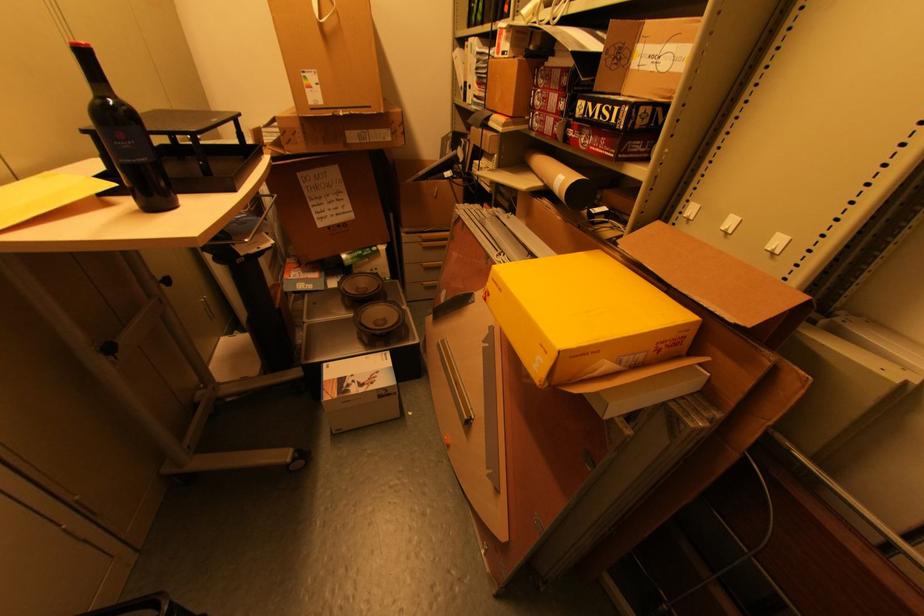
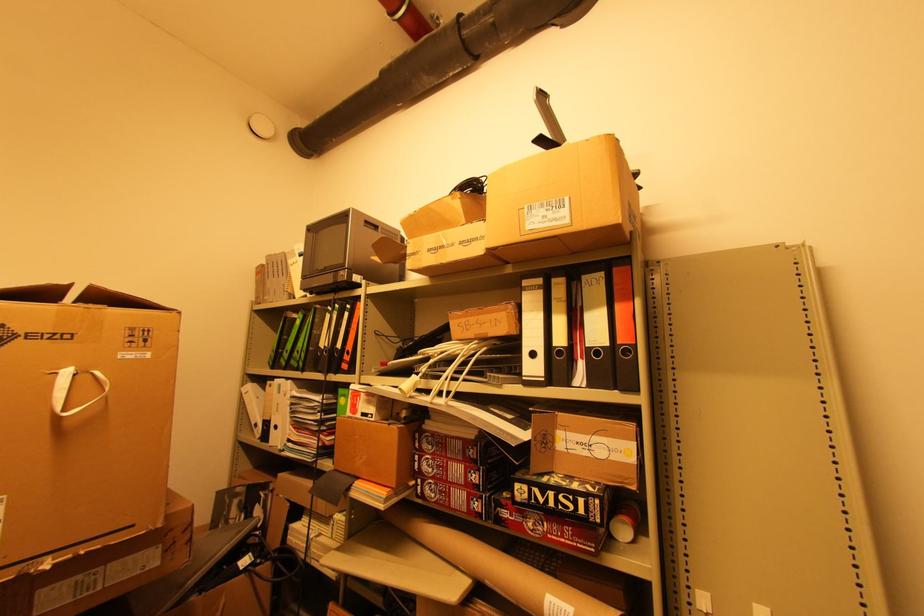
Locate, in the second image, the point that corresponds to (610,108) in the first image.

(568, 498)